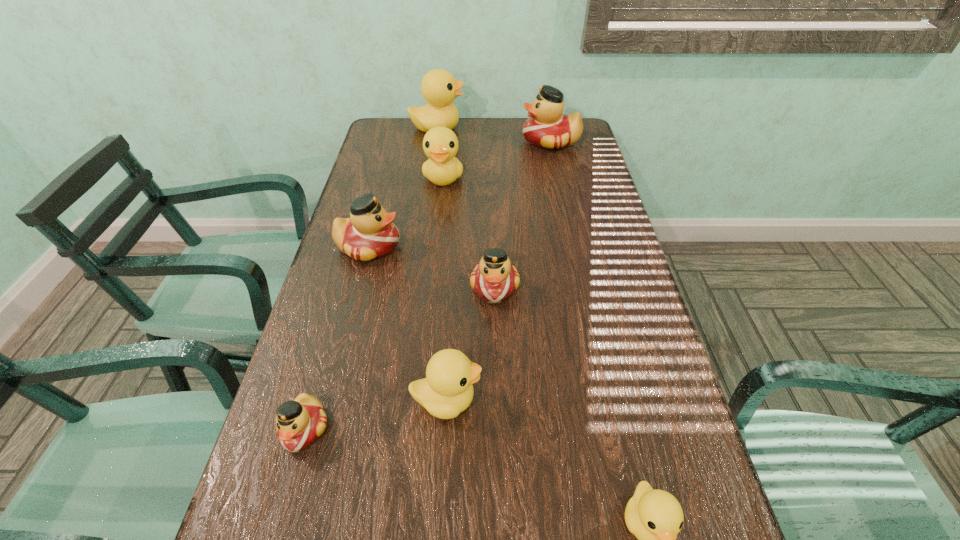
Where is `the farthest yellow duck`? the farthest yellow duck is located at coordinates (439, 88).

Locate an element on the screen. the farthest red duck is located at coordinates (548, 128).

The height and width of the screenshot is (540, 960). I want to click on the biggest red duck, so click(548, 128).

Where is `the sixth nearest object`? The height and width of the screenshot is (540, 960). the sixth nearest object is located at coordinates (440, 144).

Locate an element on the screen. the second farthest yellow duck is located at coordinates (440, 144).

In order to click on the fifth nearest duck in this screenshot , I will do `click(369, 233)`.

Image resolution: width=960 pixels, height=540 pixels. I want to click on the fourth farthest object, so click(x=369, y=233).

Locate an element on the screen. This screenshot has width=960, height=540. the second smallest yellow duck is located at coordinates (447, 390).

Identify the location of the third farthest red duck. (494, 279).

The width and height of the screenshot is (960, 540). In order to click on the fourth nearest object in this screenshot , I will do `click(494, 279)`.